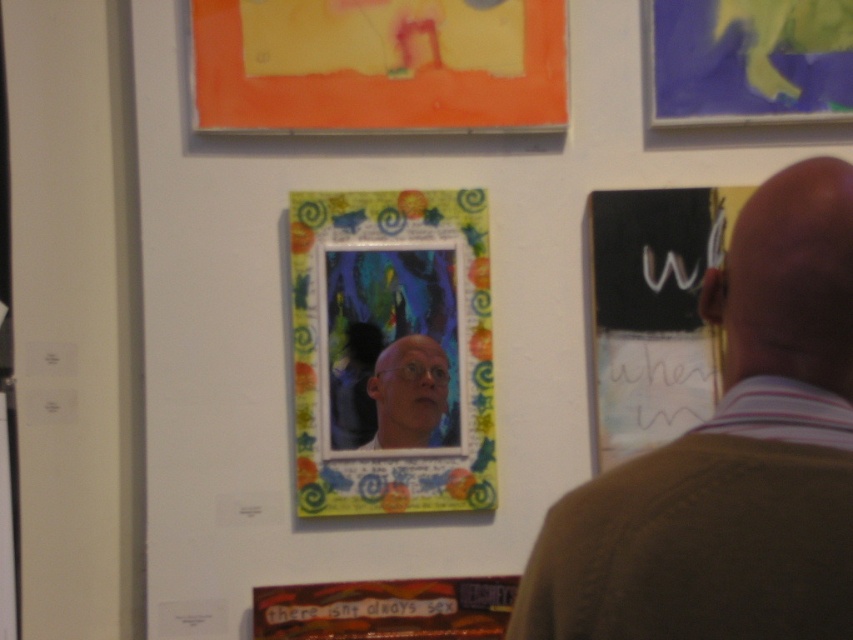
You are an art installer trying to hang two pieces on a wall. The multicolored painted frame at center and the matte bald man at center must be placed side by side. Based on the image, which one should be placed on the left to ensure they fit without overlapping?

The multicolored painted frame at center is wider than the matte bald man at center, so it should be placed on the left to ensure they fit without overlapping.

You are an art curator examining the gallery wall. You notice a point at coordinates (392,352). Which artwork does this point belong to? The multicolored painted frame at center or the black background piece with white cursive text to the right?

The point (392,352) is on the multicolored painted frame at center.